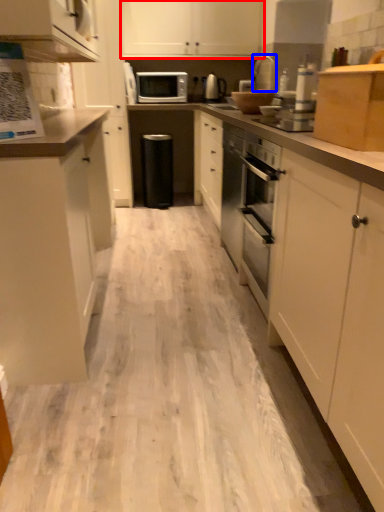
Question: Which of the following is the closest to the observer, cabinetry (highlighted by a red box) or appliance (highlighted by a blue box)?

Choices:
 (A) cabinetry
 (B) appliance

Answer: (B)